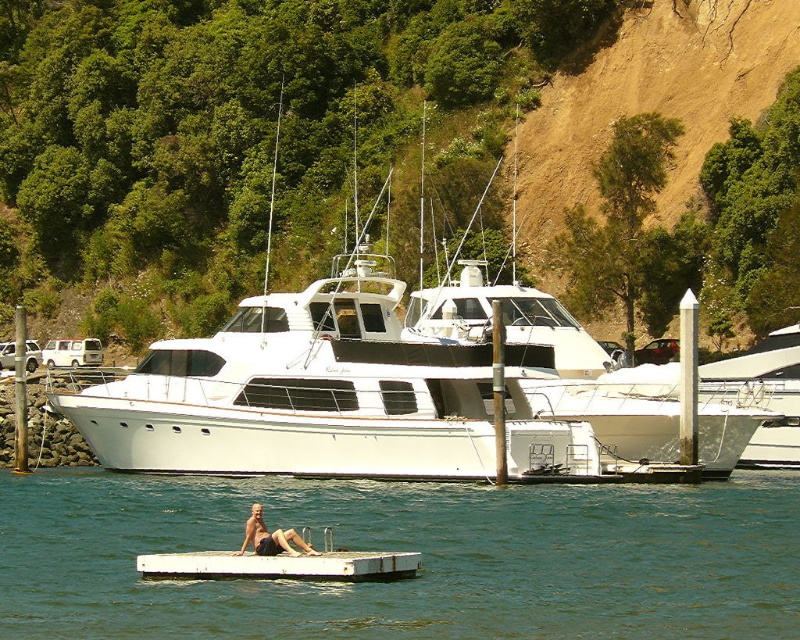
Question: Can you confirm if clear blue water at center is positioned to the left of smooth tan skin at lower center?

Choices:
 (A) no
 (B) yes

Answer: (A)

Question: Based on their relative distances, which object is nearer to the smooth tan skin at lower center?

Choices:
 (A) green leafy hillside at upper center
 (B) clear blue water at center

Answer: (B)

Question: Which is farther from the smooth tan skin at lower center?

Choices:
 (A) clear blue water at center
 (B) green leafy hillside at upper center

Answer: (B)

Question: Considering the real-world distances, which object is closest to the clear blue water at center?

Choices:
 (A) green leafy hillside at upper center
 (B) smooth tan skin at lower center

Answer: (B)

Question: Does clear blue water at center appear on the left side of smooth tan skin at lower center?

Choices:
 (A) yes
 (B) no

Answer: (B)

Question: From the image, what is the correct spatial relationship of green leafy hillside at upper center in relation to clear blue water at center?

Choices:
 (A) below
 (B) above

Answer: (B)